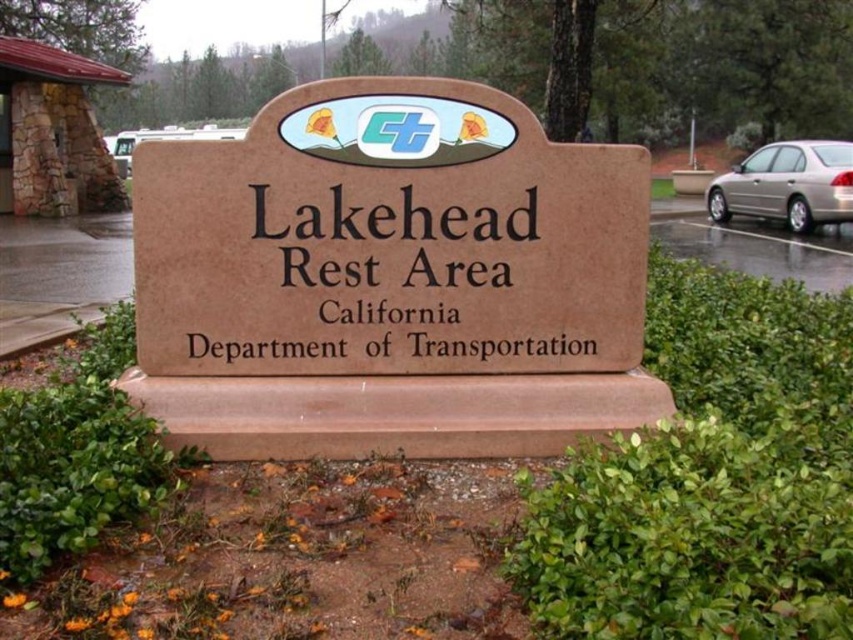
You are driving a metallic silver car at right and want to park as close as possible to the brown concrete sign at center without getting out of the car. What is the closest distance you can get to the sign while still being in the car?

The closest distance you can get to the brown concrete sign at center while staying in the metallic silver car at right is 4.70 feet, as that is the minimum distance between them.

You are standing in front of the Lakehead Rest Area sign. There are two points marked on the sign. One is at point coordinates point (387, 150) and the other is at point (3, 141). Which point is closer to you?

Point (387, 150) is in front of point (3, 141), so the point (387, 150) is closer to you.